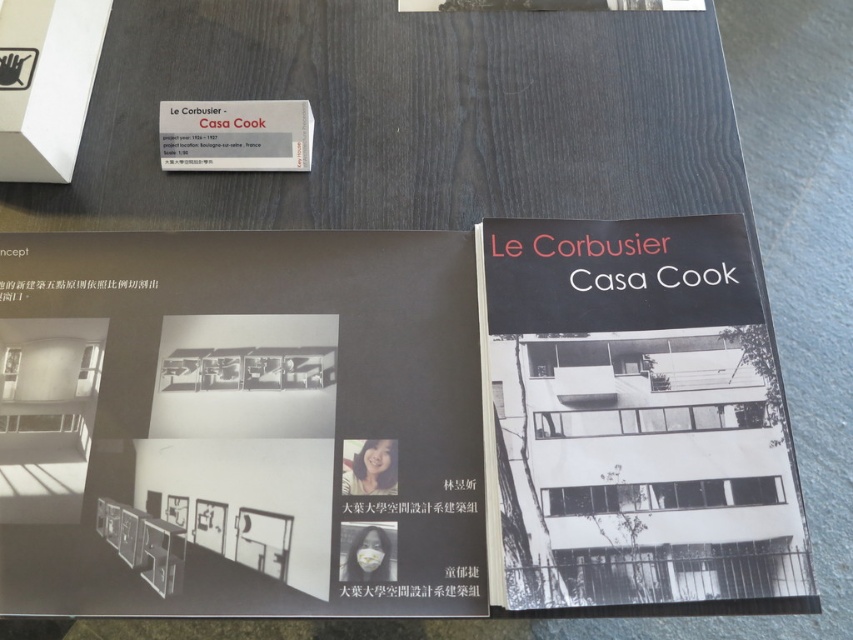
What do you see at coordinates (634, 420) in the screenshot?
I see `black matte book at center` at bounding box center [634, 420].

Which of these two, black matte book at center or matte white paper at upper left, stands shorter?

With less height is matte white paper at upper left.

Is point (630, 225) less distant than point (247, 150)?

Yes, it is in front of point (247, 150).

Locate an element on the screen. Image resolution: width=853 pixels, height=640 pixels. black matte book at center is located at coordinates 634,420.